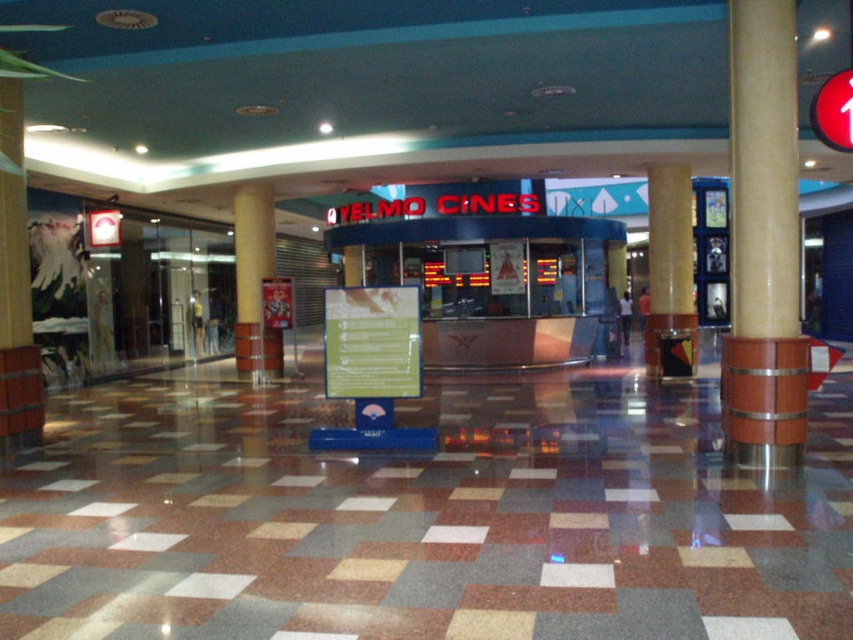
Question: Can you confirm if brown marble pillar at center is positioned to the left of brown polished pillar at center?

Choices:
 (A) yes
 (B) no

Answer: (B)

Question: Can you confirm if brown polished wood at center is positioned to the left of brown polished pillar at center?

Choices:
 (A) yes
 (B) no

Answer: (B)

Question: Which object is positioned farthest from the brown polished pillar at center?

Choices:
 (A) brown marble pillar at center
 (B) brown polished wood at center

Answer: (B)

Question: Estimate the real-world distances between objects in this image. Which object is closer to the brown marble pillar at center?

Choices:
 (A) brown polished pillar at center
 (B) brown polished wood at center

Answer: (B)

Question: Is brown polished wood at center wider than brown marble pillar at center?

Choices:
 (A) yes
 (B) no

Answer: (B)

Question: Based on their relative distances, which object is farther from the brown polished pillar at center?

Choices:
 (A) brown polished wood at center
 (B) brown marble pillar at center

Answer: (A)